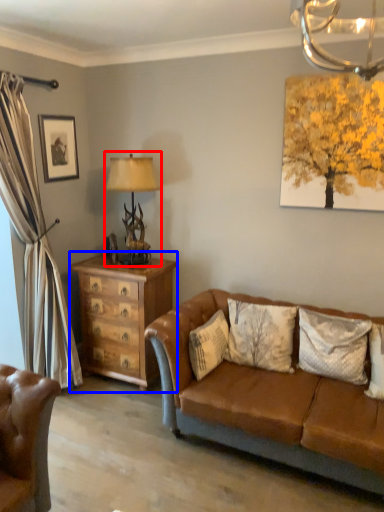
Question: Which point is further to the camera, table lamp (highlighted by a red box) or chest of drawers (highlighted by a blue box)?

Choices:
 (A) table lamp
 (B) chest of drawers

Answer: (B)